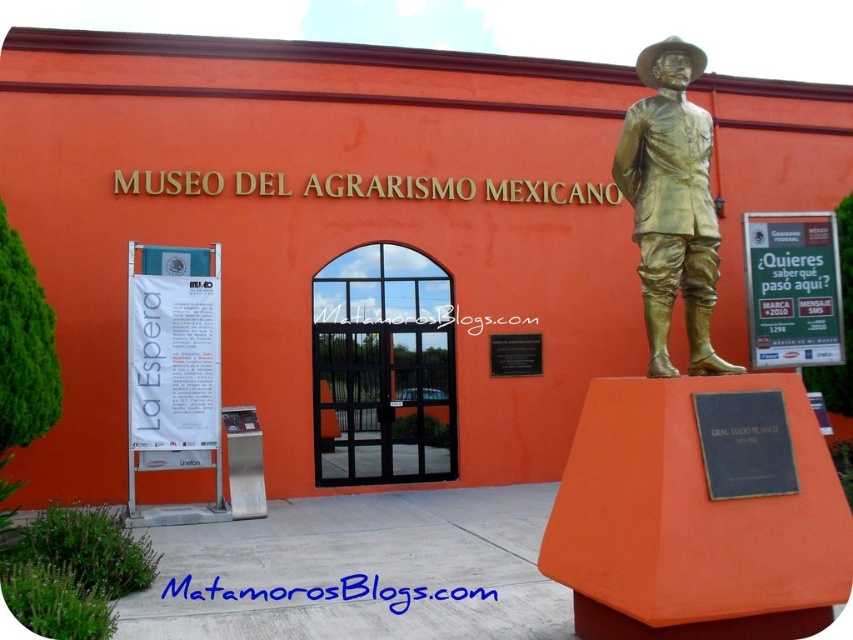
Between black glass door at center and black leather plaque at center, which one appears on the left side from the viewer's perspective?

Positioned to the left is black glass door at center.

Is black glass door at center further to the viewer compared to black leather plaque at center?

That is True.

The height and width of the screenshot is (640, 853). What do you see at coordinates (383, 369) in the screenshot? I see `black glass door at center` at bounding box center [383, 369].

The image size is (853, 640). In order to click on black glass door at center in this screenshot , I will do `click(383, 369)`.

Based on the photo, is the position of black leather plaque at center less distant than that of black polished stone plaque at center?

Yes, it is in front of black polished stone plaque at center.

Can you confirm if black leather plaque at center is positioned below black polished stone plaque at center?

Indeed, black leather plaque at center is positioned under black polished stone plaque at center.

Where is `black leather plaque at center`? The height and width of the screenshot is (640, 853). black leather plaque at center is located at coordinates (746, 444).

Looking at this image, how much distance is there between bronze statue at right and black polished stone plaque at center?

bronze statue at right and black polished stone plaque at center are 5.78 meters apart from each other.

Which of these two, bronze statue at right or black polished stone plaque at center, stands shorter?

Standing shorter between the two is black polished stone plaque at center.

Is point (709, 300) farther from camera compared to point (529, 362)?

No, (709, 300) is in front of (529, 362).

Locate an element on the screen. bronze statue at right is located at coordinates (672, 204).